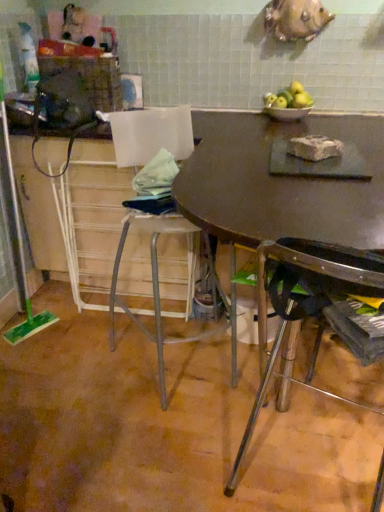
This screenshot has width=384, height=512. In order to click on green plastic screen door at left in this screenshot , I will do `click(14, 200)`.

Locate an element on the screen. The width and height of the screenshot is (384, 512). green matte apples at upper center is located at coordinates (289, 97).

Looking at this image, how much space does metallic silver chair at lower right, positioned as the 2th chair in left-to-right order, occupy vertically?

The height of metallic silver chair at lower right, positioned as the 2th chair in left-to-right order, is 37.36 inches.

Describe the element at coordinates (158, 281) in the screenshot. I see `metallic silver stool at center, marked as the first chair in a left-to-right arrangement` at that location.

What do you see at coordinates (280, 182) in the screenshot? I see `dark brown wood table at center` at bounding box center [280, 182].

The height and width of the screenshot is (512, 384). I want to click on green plastic screen door at left, so click(14, 200).

Can you tell me how much metallic silver chair at lower right, marked as the 1th chair in a right-to-left arrangement, and white crumbly block at center differ in facing direction?

122 degrees.

Is point (303, 275) positioned after point (312, 136)?

That is False.

Does metallic silver chair at lower right, marked as the 1th chair in a right-to-left arrangement, have a lesser width compared to white crumbly block at center?

No, metallic silver chair at lower right, marked as the 1th chair in a right-to-left arrangement, is not thinner than white crumbly block at center.

Measure the distance from metallic silver chair at lower right, positioned as the 2th chair in left-to-right order, to white crumbly block at center.

A distance of 22.60 inches exists between metallic silver chair at lower right, positioned as the 2th chair in left-to-right order, and white crumbly block at center.

From the picture: Between white crumbly block at center and dark brown wood table at center, which one is positioned behind?

Positioned behind is dark brown wood table at center.

Is white crumbly block at center positioned with its back to dark brown wood table at center?

No, white crumbly block at center is not facing the opposite direction of dark brown wood table at center.

Is dark brown wood table at center completely or partially inside white crumbly block at center?

No, white crumbly block at center does not contain dark brown wood table at center.

Considering the sizes of objects white crumbly block at center and dark brown wood table at center in the image provided, who is wider, white crumbly block at center or dark brown wood table at center?

dark brown wood table at center is wider.

Considering the positions of objects metallic silver chair at lower right, marked as the 1th chair in a right-to-left arrangement, and matte brown table at center in the image provided, who is in front, metallic silver chair at lower right, marked as the 1th chair in a right-to-left arrangement, or matte brown table at center?

Positioned in front is metallic silver chair at lower right, marked as the 1th chair in a right-to-left arrangement.

From the image's perspective, between metallic silver chair at lower right, positioned as the 2th chair in left-to-right order, and matte brown table at center, who is located below?

metallic silver chair at lower right, positioned as the 2th chair in left-to-right order, is shown below in the image.

Looking at this image, does metallic silver chair at lower right, marked as the 1th chair in a right-to-left arrangement, have a lesser height compared to matte brown table at center?

Incorrect, the height of metallic silver chair at lower right, marked as the 1th chair in a right-to-left arrangement, does not fall short of that of matte brown table at center.

From a real-world perspective, which object stands above the other?

metallic silver chair at lower right, positioned as the 2th chair in left-to-right order, is physically above.

Between green plastic screen door at left and metallic silver stool at center, marked as the first chair in a left-to-right arrangement, which one has smaller width?

green plastic screen door at left is thinner.

Is metallic silver stool at center, which ranks as the second chair in right-to-left order, completely or partially inside green plastic screen door at left?

No, metallic silver stool at center, which ranks as the second chair in right-to-left order, is located outside of green plastic screen door at left.

Locate an element on the screen. the 1st chair located beneath the green plastic screen door at left (from a real-world perspective) is located at coordinates (158, 281).

How different are the orientations of green plastic screen door at left and metallic silver stool at center, which ranks as the second chair in right-to-left order, in degrees?

The angular difference between green plastic screen door at left and metallic silver stool at center, which ranks as the second chair in right-to-left order, is 41.9 degrees.

Is point (121, 149) positioned behind point (290, 221)?

Yes, it is behind point (290, 221).

What's the angular difference between metallic silver stool at center, marked as the first chair in a left-to-right arrangement, and matte brown table at center's facing directions?

47.3 degrees.

Is metallic silver stool at center, which ranks as the second chair in right-to-left order, inside or outside of matte brown table at center?

The correct answer is: inside.

Is green matte apples at upper center oriented towards white crumbly block at center?

Yes, green matte apples at upper center is turned towards white crumbly block at center.

Is green matte apples at upper center next to white crumbly block at center?

No, green matte apples at upper center is not touching white crumbly block at center.

Between green matte apples at upper center and white crumbly block at center, which one has less height?

With less height is white crumbly block at center.

Which is more to the left, white crumbly block at center or green plastic screen door at left?

green plastic screen door at left.

Is green plastic screen door at left at the back of white crumbly block at center?

No, white crumbly block at center is not facing away from green plastic screen door at left.

From the image's perspective, is white crumbly block at center located beneath green plastic screen door at left?

Incorrect, from the image's perspective, white crumbly block at center is higher than green plastic screen door at left.

Locate an element on the screen. food lying behind the metallic silver chair at lower right, positioned as the 2th chair in left-to-right order is located at coordinates (314, 148).

In order to click on counter top below the white crumbly block at center (from a real-world perspective) in this screenshot , I will do `click(280, 182)`.

When comparing their distances from green matte apples at upper center, does metallic silver chair at lower right, marked as the 1th chair in a right-to-left arrangement, or green plastic screen door at left seem further?

green plastic screen door at left lies further to green matte apples at upper center than the other object.

Looking at the image, which one is located further to green plastic screen door at left, green matte apples at upper center or white crumbly block at center?

Among the two, white crumbly block at center is located further to green plastic screen door at left.

Looking at the image, which one is located closer to white crumbly block at center, green plastic screen door at left or metallic silver stool at center, marked as the first chair in a left-to-right arrangement?

metallic silver stool at center, marked as the first chair in a left-to-right arrangement, is positioned closer to the anchor white crumbly block at center.

From the picture: Looking at the image, which one is located closer to green plastic screen door at left, metallic silver stool at center, which ranks as the second chair in right-to-left order, or green matte apples at upper center?

The object closer to green plastic screen door at left is metallic silver stool at center, which ranks as the second chair in right-to-left order.

Which object lies nearer to the anchor point green matte apples at upper center, metallic silver chair at lower right, positioned as the 2th chair in left-to-right order, or matte brown table at center?

The object closer to green matte apples at upper center is matte brown table at center.

When comparing their distances from white crumbly block at center, does green matte apples at upper center or metallic silver chair at lower right, marked as the 1th chair in a right-to-left arrangement, seem further?

green matte apples at upper center lies further to white crumbly block at center than the other object.

Looking at the image, which one is located closer to green plastic screen door at left, metallic silver stool at center, marked as the first chair in a left-to-right arrangement, or metallic silver chair at lower right, marked as the 1th chair in a right-to-left arrangement?

metallic silver stool at center, marked as the first chair in a left-to-right arrangement, lies closer to green plastic screen door at left than the other object.

Considering their positions, is white crumbly block at center positioned closer to matte brown table at center than green plastic screen door at left?

white crumbly block at center.

In order to click on counter top situated between green plastic screen door at left and metallic silver chair at lower right, positioned as the 2th chair in left-to-right order, from left to right in this screenshot , I will do `click(280, 182)`.

Identify the location of food between metallic silver chair at lower right, marked as the 1th chair in a right-to-left arrangement, and dark brown wood table at center from front to back. (314, 148).

Image resolution: width=384 pixels, height=512 pixels. In order to click on food between matte brown table at center and dark brown wood table at center in the front-back direction in this screenshot , I will do `click(314, 148)`.

The height and width of the screenshot is (512, 384). I want to click on food between metallic silver stool at center, which ranks as the second chair in right-to-left order, and dark brown wood table at center from front to back, so click(x=314, y=148).